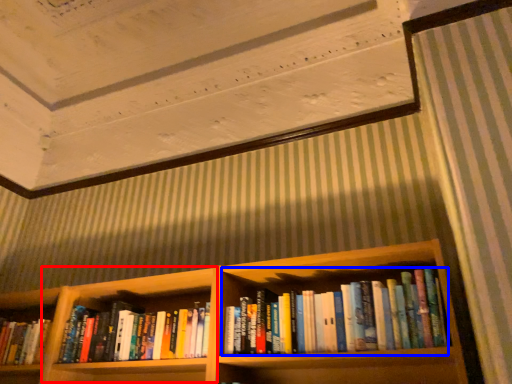
Question: Among these objects, which one is farthest to the camera, cabinet (highlighted by a red box) or book (highlighted by a blue box)?

Choices:
 (A) cabinet
 (B) book

Answer: (A)